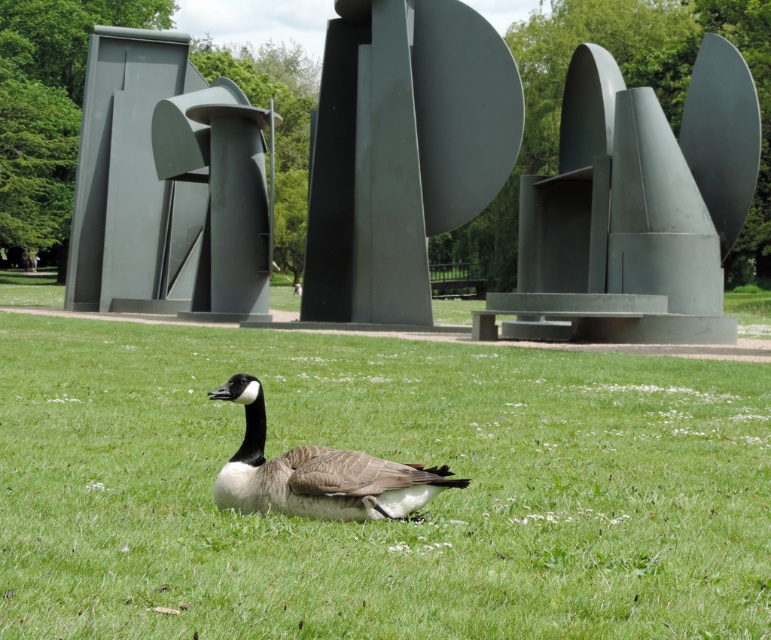
Consider the image. You are a photographer trying to capture the metallic gray abstract sculpture at center and the brown feathered duck at center in the same frame. Based on their positions, which object should you adjust your camera to focus on first if you want to include both in your shot?

The metallic gray abstract sculpture at center is to the left of the brown feathered duck at center, so you should focus on the metallic gray abstract sculpture at center first to ensure both are in the frame.